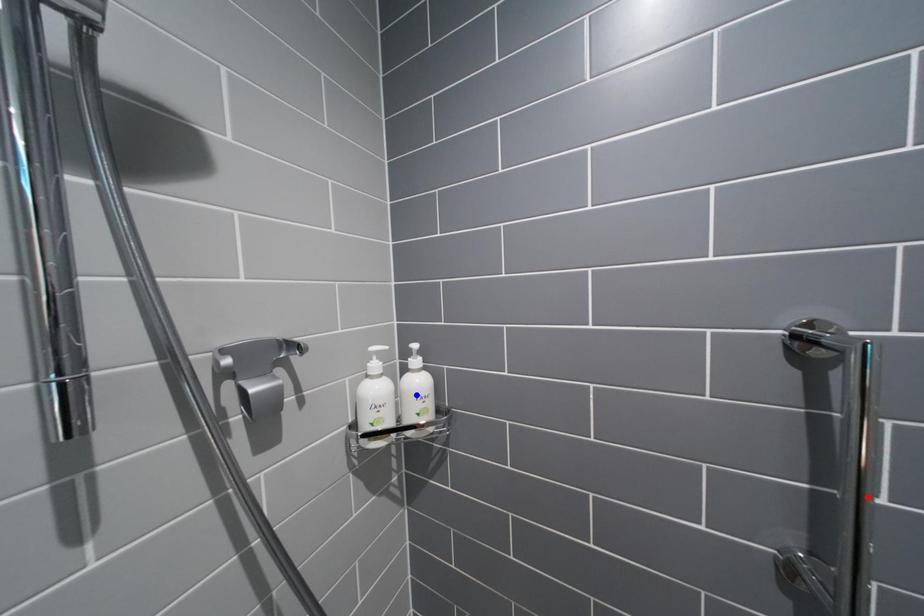
Question: Two points are marked on the image. Which point is closer to the camera?

Choices:
 (A) Blue point is closer.
 (B) Red point is closer.

Answer: (B)